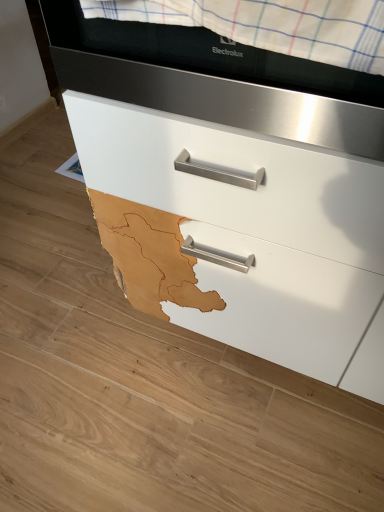
What do you see at coordinates (235, 187) in the screenshot?
I see `white matte drawer at center` at bounding box center [235, 187].

Locate an element on the screen. This screenshot has width=384, height=512. white matte drawer at center is located at coordinates (235, 187).

This screenshot has height=512, width=384. What are the coordinates of `white matte drawer at center` in the screenshot? It's located at (235, 187).